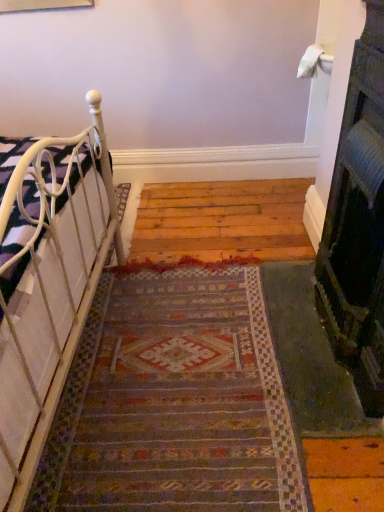
Question: From a real-world perspective, is multicolored woven rug at center physically located above or below black textured fireplace at right?

Choices:
 (A) above
 (B) below

Answer: (B)

Question: Considering the positions of multicolored woven rug at center and black textured fireplace at right in the image, is multicolored woven rug at center wider or thinner than black textured fireplace at right?

Choices:
 (A) wide
 (B) thin

Answer: (A)

Question: Which object is positioned closest to the black textured fireplace at right?

Choices:
 (A) multicolored woven rug at center
 (B) white metal bed at left

Answer: (A)

Question: Which object is the farthest from the white metal bed at left?

Choices:
 (A) multicolored woven rug at center
 (B) black textured fireplace at right

Answer: (B)